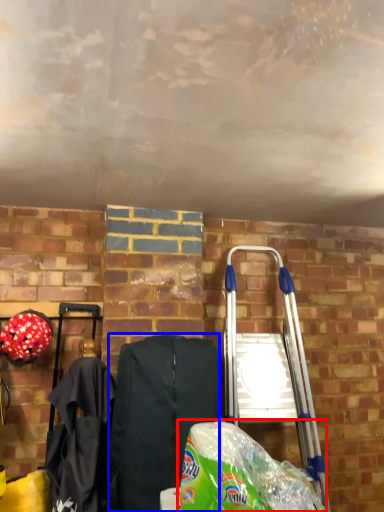
Question: Which of the following is the farthest to the observer, grocery bag (highlighted by a red box) or folding chair (highlighted by a blue box)?

Choices:
 (A) grocery bag
 (B) folding chair

Answer: (B)